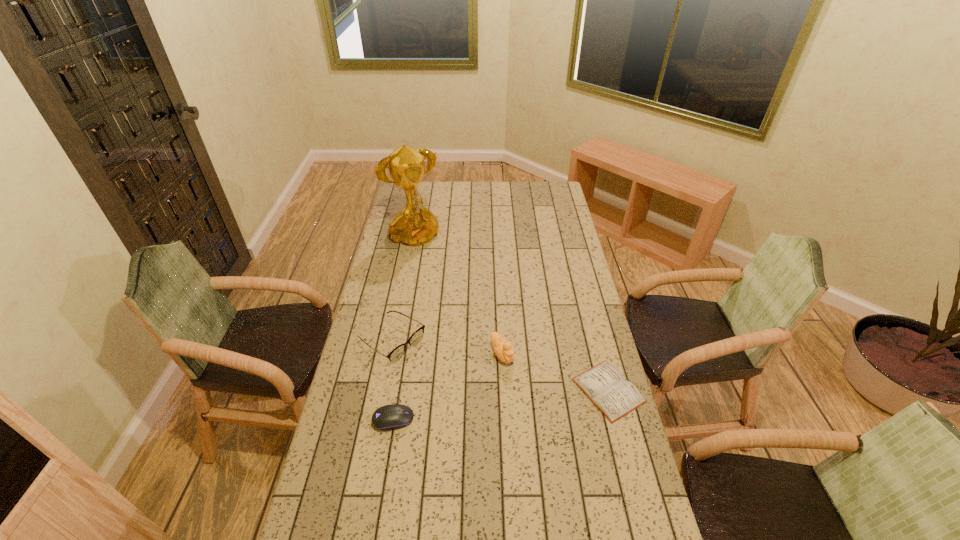
Locate an element on the screen. Image resolution: width=960 pixels, height=540 pixels. computer mouse is located at coordinates tap(393, 416).

This screenshot has width=960, height=540. Identify the location of the rightmost object. tap(605, 386).

The width and height of the screenshot is (960, 540). I want to click on diary, so [x=605, y=386].

At what (x,y) coordinates should I click in order to perform the action: click on the third shortest object. Please return your answer as a coordinate pair (x, y). The height and width of the screenshot is (540, 960). Looking at the image, I should click on (416, 337).

At what (x,y) coordinates should I click in order to perform the action: click on duckling. Please return your answer as a coordinate pair (x, y). Looking at the image, I should click on (504, 352).

This screenshot has height=540, width=960. Find the location of `the second object from right to left`. the second object from right to left is located at coordinates (504, 352).

Find the location of `the tallest object`. the tallest object is located at coordinates coord(415,225).

Find the location of a particular element. The height and width of the screenshot is (540, 960). the farthest object is located at coordinates (415, 225).

Find the location of a particular element. Image resolution: width=960 pixels, height=540 pixels. vacant region located on the right of the fourth tallest object is located at coordinates (486, 420).

At what (x,y) coordinates should I click in order to perform the action: click on vacant area located 0.050m on the left of the shortest object. Please return your answer as a coordinate pair (x, y). The image size is (960, 540). Looking at the image, I should click on click(x=559, y=390).